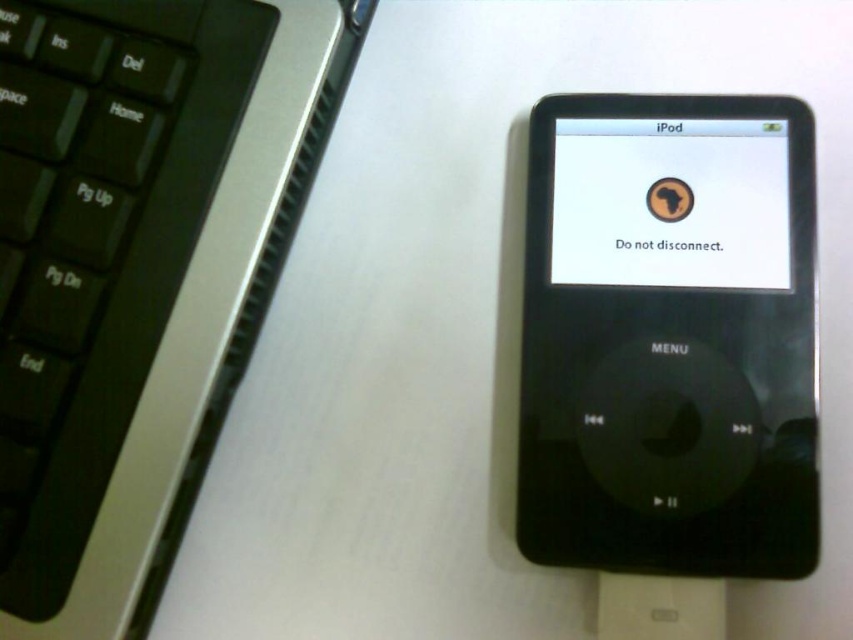
Measure the distance from black plastic keyboard at upper left to black matte ipod at center.

They are 14.68 inches apart.

Locate an element on the screen. Image resolution: width=853 pixels, height=640 pixels. black plastic keyboard at upper left is located at coordinates (137, 272).